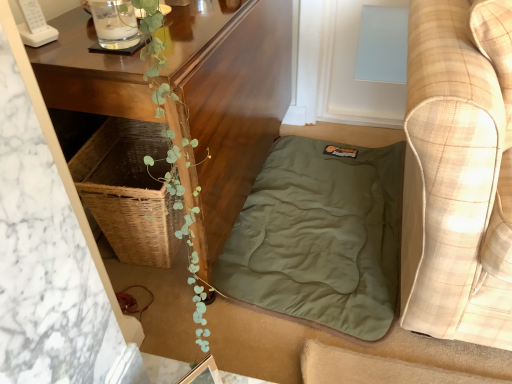
Describe the element at coordinates (231, 97) in the screenshot. This screenshot has height=384, width=512. I see `wooden table at center` at that location.

Where is `wooden table at center`? Image resolution: width=512 pixels, height=384 pixels. wooden table at center is located at coordinates (231, 97).

From a real-world perspective, is wooden table at center on plaid fabric couch at right?

No, from a real-world perspective, wooden table at center is not on top of plaid fabric couch at right.

Is wooden table at center inside the boundaries of plaid fabric couch at right, or outside?

wooden table at center is outside plaid fabric couch at right.

Is wooden table at center placed right next to plaid fabric couch at right?

No, wooden table at center is not touching plaid fabric couch at right.

Between wooden table at center and plaid fabric couch at right, which one has larger size?

With larger size is plaid fabric couch at right.

Is wooden table at center to the right of olive green fabric at lower center from the viewer's perspective?

No, wooden table at center is not to the right of olive green fabric at lower center.

From the image's perspective, is wooden table at center located above olive green fabric at lower center?

Yes, from the image's perspective, wooden table at center is on top of olive green fabric at lower center.

Identify the location of blanket below the wooden table at center (from the image's perspective). This screenshot has height=384, width=512. (320, 237).

Does point (111, 88) come closer to viewer compared to point (234, 282)?

Yes, it is.

Between olive green fabric at lower center and plaid fabric couch at right, which one is positioned behind?

olive green fabric at lower center is further away from the camera.

Identify the location of studio couch above the olive green fabric at lower center (from a real-world perspective). (458, 172).

From a real-world perspective, which is physically below, olive green fabric at lower center or plaid fabric couch at right?

From a 3D spatial view, olive green fabric at lower center is below.

Based on their sizes in the image, would you say olive green fabric at lower center is bigger or smaller than plaid fabric couch at right?

In the image, olive green fabric at lower center appears to be smaller than plaid fabric couch at right.

Does olive green fabric at lower center lie in front of wooden table at center?

No, it is not.

Considering the sizes of olive green fabric at lower center and wooden table at center in the image, is olive green fabric at lower center bigger or smaller than wooden table at center?

In the image, olive green fabric at lower center appears to be smaller than wooden table at center.

Can you confirm if olive green fabric at lower center is shorter than wooden table at center?

Yes.

Does olive green fabric at lower center turn towards wooden table at center?

No, olive green fabric at lower center is not aimed at wooden table at center.

Who is taller, plaid fabric couch at right or wooden table at center?

plaid fabric couch at right.

How distant is plaid fabric couch at right from wooden table at center?

The distance of plaid fabric couch at right from wooden table at center is 20.75 inches.

Between point (422, 246) and point (241, 92), which one is positioned in front?

The point (422, 246) is closer.

Is plaid fabric couch at right far away from wooden table at center?

They are positioned close to each other.

Find the location of a particular element. The height and width of the screenshot is (384, 512). blanket below the plaid fabric couch at right (from a real-world perspective) is located at coordinates (320, 237).

Is plaid fabric couch at right facing away from olive green fabric at lower center?

No, olive green fabric at lower center is not at the back of plaid fabric couch at right.

Does plaid fabric couch at right appear on the right side of olive green fabric at lower center?

Correct, you'll find plaid fabric couch at right to the right of olive green fabric at lower center.

In the scene shown: Which point is more distant from viewer, (441, 8) or (322, 180)?

Point (322, 180)

Find the location of a particular element. studio couch below the wooden table at center (from the image's perspective) is located at coordinates (458, 172).

Where is `blanket below the wooden table at center (from a real-world perspective)`? This screenshot has height=384, width=512. blanket below the wooden table at center (from a real-world perspective) is located at coordinates (320, 237).

From the image, which object appears to be nearer to wooden table at center, olive green fabric at lower center or plaid fabric couch at right?

olive green fabric at lower center lies closer to wooden table at center than the other object.

Based on their spatial positions, is olive green fabric at lower center or wooden table at center closer to plaid fabric couch at right?

olive green fabric at lower center is positioned closer to the anchor plaid fabric couch at right.

Estimate the real-world distances between objects in this image. Which object is further from plaid fabric couch at right, wooden table at center or olive green fabric at lower center?

wooden table at center.

Considering their positions, is wooden table at center positioned further to olive green fabric at lower center than plaid fabric couch at right?

plaid fabric couch at right lies further to olive green fabric at lower center than the other object.

Estimate the real-world distances between objects in this image. Which object is further from olive green fabric at lower center, plaid fabric couch at right or wooden table at center?

Based on the image, plaid fabric couch at right appears to be further to olive green fabric at lower center.

When comparing their distances from wooden table at center, does plaid fabric couch at right or olive green fabric at lower center seem further?

Among the two, plaid fabric couch at right is located further to wooden table at center.

This screenshot has width=512, height=384. I want to click on blanket between wooden table at center and plaid fabric couch at right in the horizontal direction, so click(x=320, y=237).